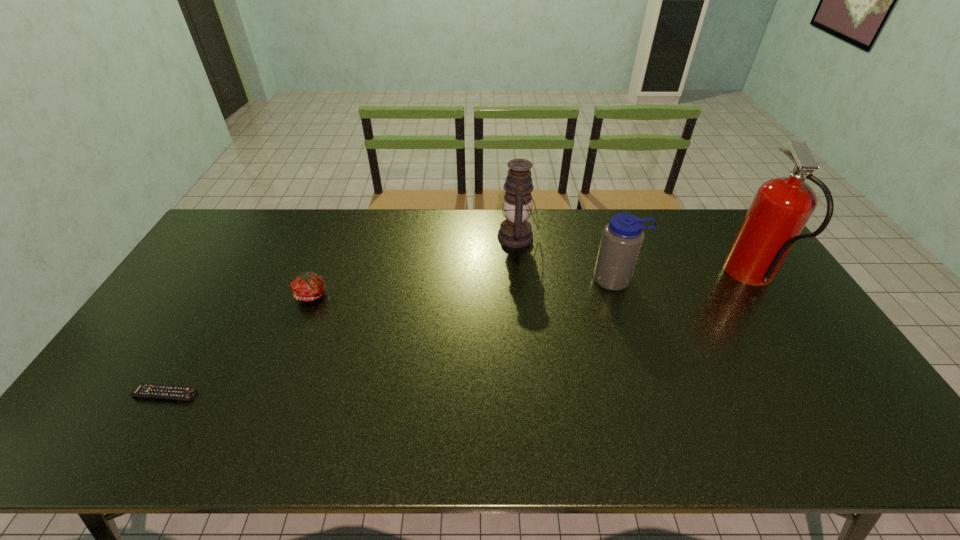
At what (x,y) coordinates should I click in order to perform the action: click on object present at the right edge. Please return your answer as a coordinate pair (x, y). Image resolution: width=960 pixels, height=540 pixels. Looking at the image, I should click on (781, 208).

This screenshot has height=540, width=960. Find the location of `object present at the far right corner`. object present at the far right corner is located at coordinates (781, 208).

The width and height of the screenshot is (960, 540). In order to click on vacant space at the far edge in this screenshot , I will do `click(393, 208)`.

Identify the location of vacant space at the near edge of the desktop. (389, 421).

Image resolution: width=960 pixels, height=540 pixels. In the image, there is a desktop. In order to click on vacant space at the left edge in this screenshot , I will do click(156, 340).

In the image, there is a desktop. Where is `vacant space at the right edge`? This screenshot has height=540, width=960. vacant space at the right edge is located at coordinates (810, 380).

The height and width of the screenshot is (540, 960). In the image, there is a desktop. Identify the location of free region at the far left corner. (215, 247).

You are a GUI agent. You are given a task and a screenshot of the screen. Output one action in this format:
    pyautogui.click(x=<x>, y=<y>)
    Task: Click on the free space between the fourth object from right to left and the oil lamp
    The image size is (960, 540).
    Given the screenshot: What is the action you would take?
    pyautogui.click(x=415, y=266)

Identify the location of free spot between the shortest object and the fourth shortest object. This screenshot has width=960, height=540. (341, 315).

Identify the location of vacant area between the shortest object and the oil lamp. This screenshot has height=540, width=960. (341, 315).